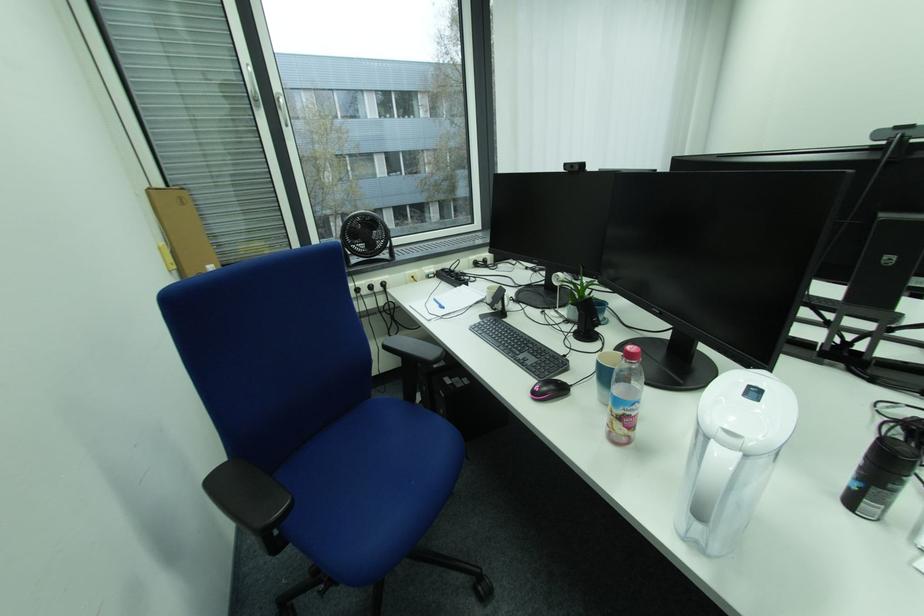
Describe the element at coordinates (365, 238) in the screenshot. I see `the small black fan` at that location.